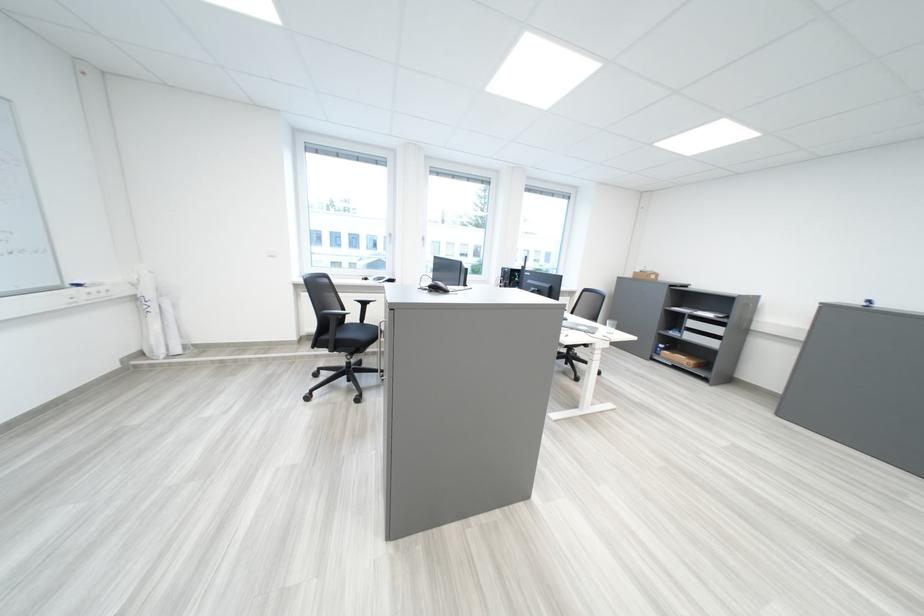
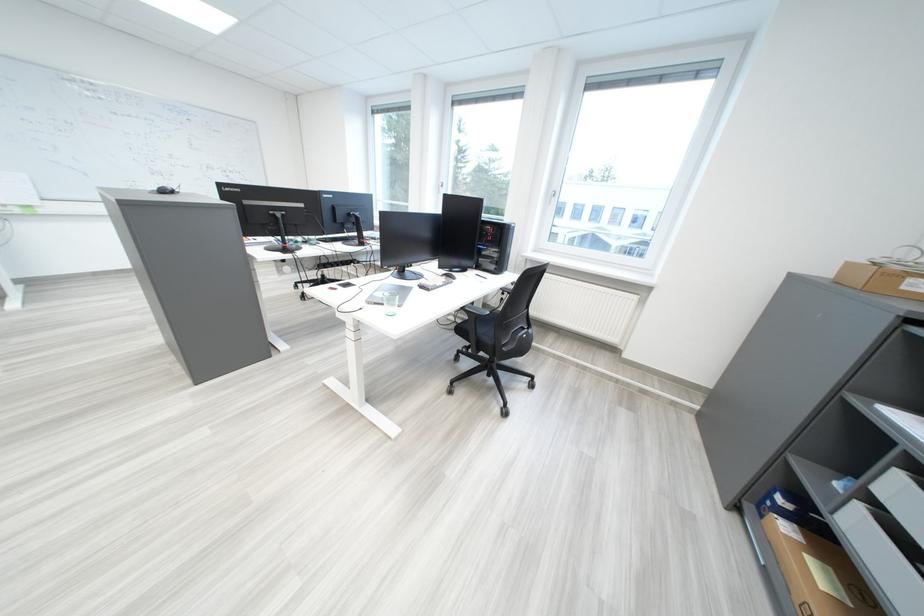
Question: I am providing you with two images of the same scene from different viewpoints. Which of the following objects are not visible in image2?

Choices:
 (A) red cleaning sponge
 (B) black chair sitting surface
 (C) cardboard box
 (D) black computer mouse

Answer: (B)